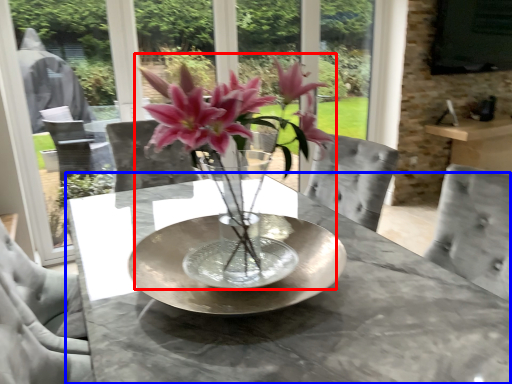
Question: Which of the following is the closest to the observer, houseplant (highlighted by a red box) or table (highlighted by a blue box)?

Choices:
 (A) houseplant
 (B) table

Answer: (A)